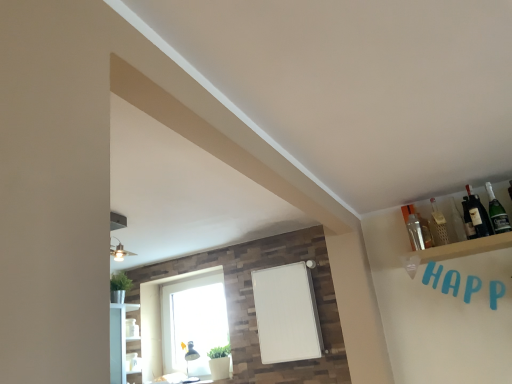
Question: Is dark glass bottle at upper right, the 4th bottle from the left, further to the viewer compared to white glass window at lower center?

Choices:
 (A) yes
 (B) no

Answer: (B)

Question: Is dark glass bottle at upper right, positioned as the second bottle in right-to-left order, turned away from white glass window at lower center?

Choices:
 (A) yes
 (B) no

Answer: (B)

Question: From a real-world perspective, is dark glass bottle at upper right, the 4th bottle from the left, on top of white glass window at lower center?

Choices:
 (A) no
 (B) yes

Answer: (B)

Question: Does dark glass bottle at upper right, positioned as the second bottle in right-to-left order, have a lesser height compared to white glass window at lower center?

Choices:
 (A) no
 (B) yes

Answer: (B)

Question: Is dark glass bottle at upper right, positioned as the second bottle in right-to-left order, smaller than white glass window at lower center?

Choices:
 (A) no
 (B) yes

Answer: (B)

Question: From the image's perspective, is matte glass bottle at upper right, marked as the third bottle in a left-to-right arrangement, located above or below dark glass bottle at upper right, positioned as the second bottle in right-to-left order?

Choices:
 (A) below
 (B) above

Answer: (A)

Question: Is point [464, 220] positioned closer to the camera than point [477, 220]?

Choices:
 (A) closer
 (B) farther

Answer: (B)

Question: In the image, is matte glass bottle at upper right, positioned as the 3th bottle in right-to-left order, positioned in front of or behind dark glass bottle at upper right, the 4th bottle from the left?

Choices:
 (A) front
 (B) behind

Answer: (B)

Question: From a real-world perspective, is matte glass bottle at upper right, marked as the third bottle in a left-to-right arrangement, positioned above or below dark glass bottle at upper right, positioned as the second bottle in right-to-left order?

Choices:
 (A) below
 (B) above

Answer: (A)

Question: Considering the relative positions of dark glass bottle at upper right, the 4th bottle from the left, and green glass bottle at upper right, which is the first bottle from right to left, in the image provided, is dark glass bottle at upper right, the 4th bottle from the left, to the left or to the right of green glass bottle at upper right, which is the first bottle from right to left,?

Choices:
 (A) left
 (B) right

Answer: (A)

Question: Is dark glass bottle at upper right, the 4th bottle from the left, taller or shorter than green glass bottle at upper right, which is the first bottle from right to left?

Choices:
 (A) short
 (B) tall

Answer: (B)

Question: In terms of size, does dark glass bottle at upper right, the 4th bottle from the left, appear bigger or smaller than green glass bottle at upper right, which is the 5th bottle from left to right?

Choices:
 (A) small
 (B) big

Answer: (A)

Question: From the image's perspective, is dark glass bottle at upper right, positioned as the second bottle in right-to-left order, above or below green glass bottle at upper right, which is the first bottle from right to left?

Choices:
 (A) above
 (B) below

Answer: (B)

Question: Is white glass window at lower center to the left or to the right of clear glass bottle at upper right, placed as the 1th bottle when sorted from left to right, in the image?

Choices:
 (A) left
 (B) right

Answer: (A)

Question: Is point (150, 344) closer or farther from the camera than point (413, 221)?

Choices:
 (A) farther
 (B) closer

Answer: (A)